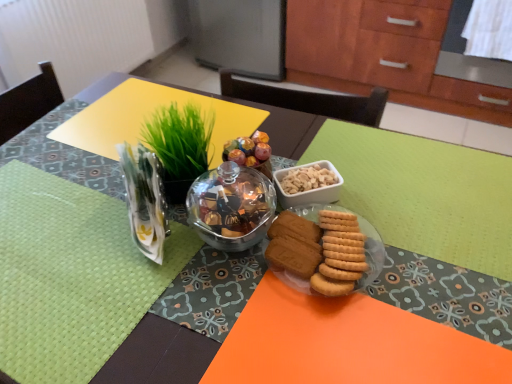
In order to click on vacant area located to the right-hand side of golden matte cookies at center in this screenshot , I will do [426, 285].